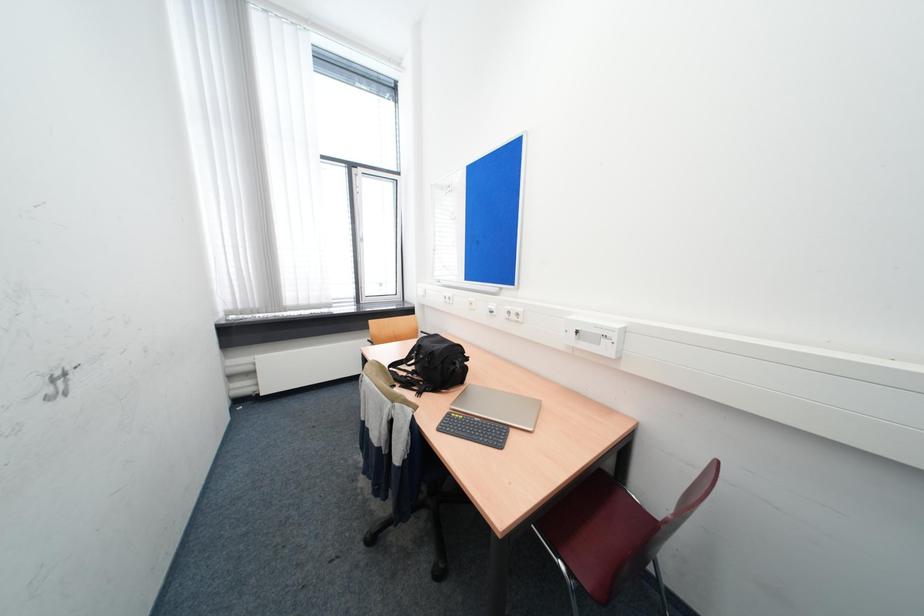
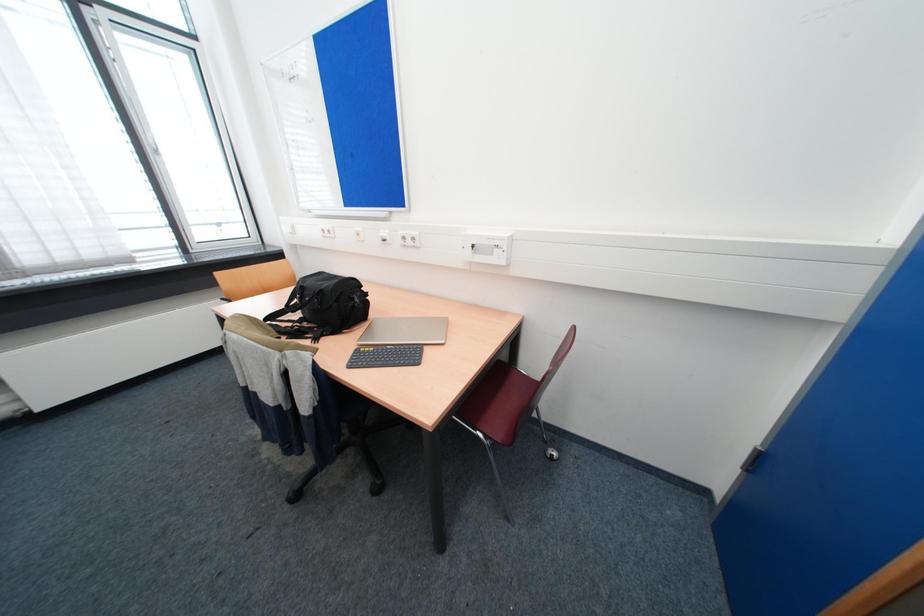
Question: The camera is either moving clockwise (left) or counter-clockwise (right) around the object. The first image is from the beginning of the video and the second image is from the end. Is the camera moving left or right when shooting the video?

Choices:
 (A) Left
 (B) Right

Answer: (A)